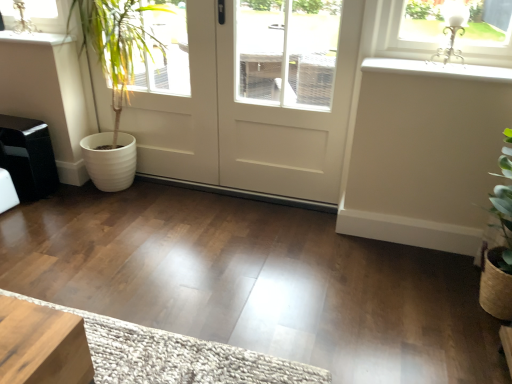
Question: Is white matte door at center wider than white ribbed pot at left?

Choices:
 (A) yes
 (B) no

Answer: (B)

Question: From a real-world perspective, is white matte door at center over white ribbed pot at left?

Choices:
 (A) no
 (B) yes

Answer: (B)

Question: From a real-world perspective, is white matte door at center below white ribbed pot at left?

Choices:
 (A) yes
 (B) no

Answer: (B)

Question: Can you confirm if white matte door at center is positioned to the left of white ribbed pot at left?

Choices:
 (A) yes
 (B) no

Answer: (B)

Question: From the image's perspective, is white matte door at center located beneath white ribbed pot at left?

Choices:
 (A) yes
 (B) no

Answer: (A)

Question: Based on their positions, is white smooth window sill at upper right, arranged as the first window sill when viewed from the front, located to the left or right of white ribbed pot at left?

Choices:
 (A) right
 (B) left

Answer: (A)

Question: Is white smooth window sill at upper right, the second window sill positioned from the back, in front of or behind white ribbed pot at left in the image?

Choices:
 (A) front
 (B) behind

Answer: (A)

Question: From the image's perspective, is white smooth window sill at upper right, which is the first window sill from right to left, positioned above or below white ribbed pot at left?

Choices:
 (A) below
 (B) above

Answer: (A)

Question: Is white smooth window sill at upper right, the second window sill positioned from the back, inside or outside of white ribbed pot at left?

Choices:
 (A) inside
 (B) outside

Answer: (B)

Question: From the image's perspective, relative to white matte door at center, is white textured doormat at lower center above or below?

Choices:
 (A) below
 (B) above

Answer: (A)

Question: Is white textured doormat at lower center taller or shorter than white matte door at center?

Choices:
 (A) short
 (B) tall

Answer: (A)

Question: Is point (145, 329) positioned closer to the camera than point (202, 16)?

Choices:
 (A) farther
 (B) closer

Answer: (B)

Question: Considering the positions of white textured doormat at lower center and white matte door at center in the image, is white textured doormat at lower center wider or thinner than white matte door at center?

Choices:
 (A) thin
 (B) wide

Answer: (B)

Question: From a real-world perspective, is white glossy window sill at upper left, which is the 2th window sill from right to left, above or below white ribbed pot at left?

Choices:
 (A) above
 (B) below

Answer: (A)

Question: From the image's perspective, is white glossy window sill at upper left, the first window sill in the left-to-right sequence, located above or below white ribbed pot at left?

Choices:
 (A) below
 (B) above

Answer: (B)